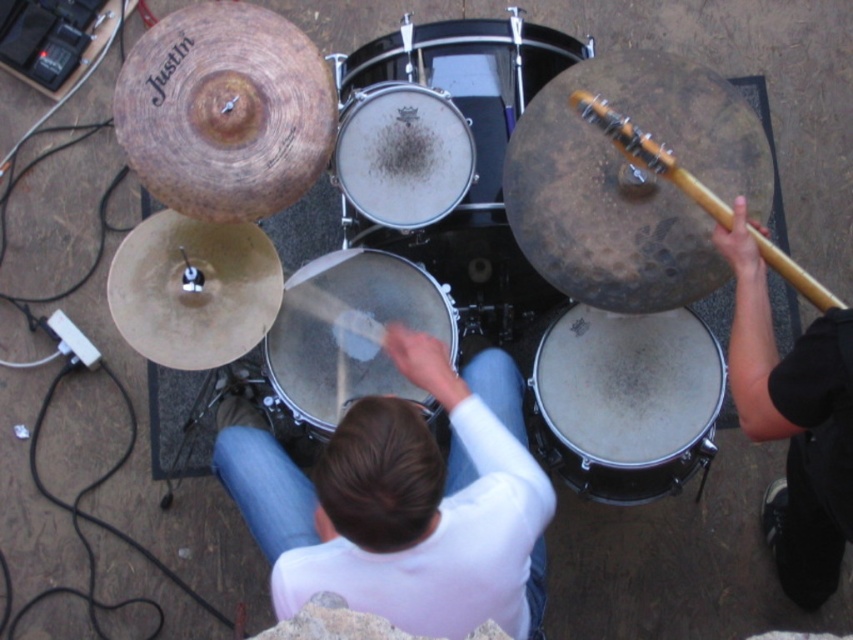
You are a stagehand setting up a new microphone stand. You need to place it between the black fabric arm at right and the smooth black drum at center. Which side of the microphone stand should face the larger object?

The black fabric arm at right is bigger than the smooth black drum at center, so the microphone stand should face the black fabric arm at right since it is the larger object.

You are a stagehand who needs to place a 24 inch wide equipment box between the white matte drum at lower right and the wooden guitar neck at upper right. Can the box fit in the space between them?

The white matte drum at lower right and wooden guitar neck at upper right are 22.05 inches apart from each other. Since the equipment box is 24 inches wide, it cannot fit in the space between them as the distance is smaller than the box.